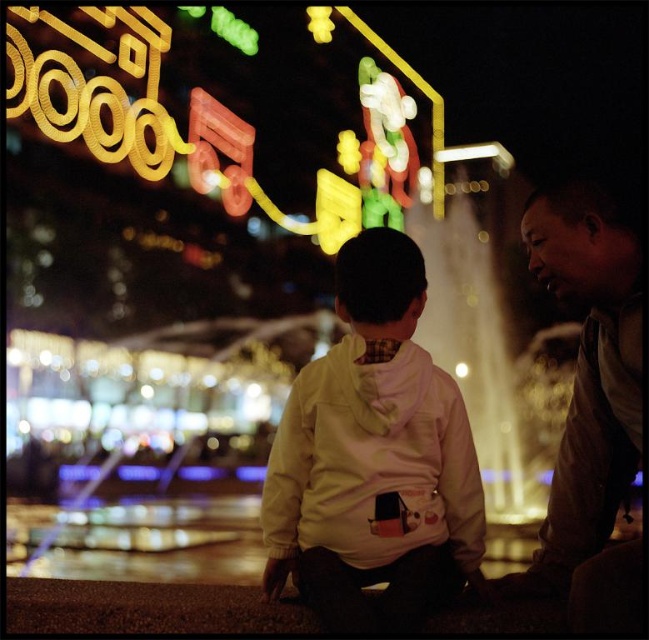
Does white fleece jacket at center lie behind brown leather jacket at right?

Yes.

Who is more distant from viewer, (265, 544) or (602, 580)?

Positioned behind is point (265, 544).

Identify the location of white fleece jacket at center. (373, 456).

This screenshot has height=640, width=649. What are the coordinates of `white fleece jacket at center` in the screenshot? It's located at (373, 456).